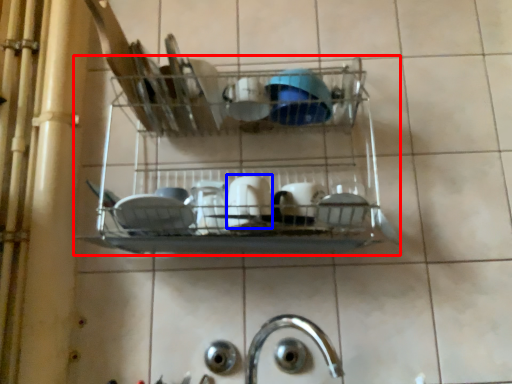
Question: Which object is closer to the camera taking this photo, shelf (highlighted by a red box) or tableware (highlighted by a blue box)?

Choices:
 (A) shelf
 (B) tableware

Answer: (A)